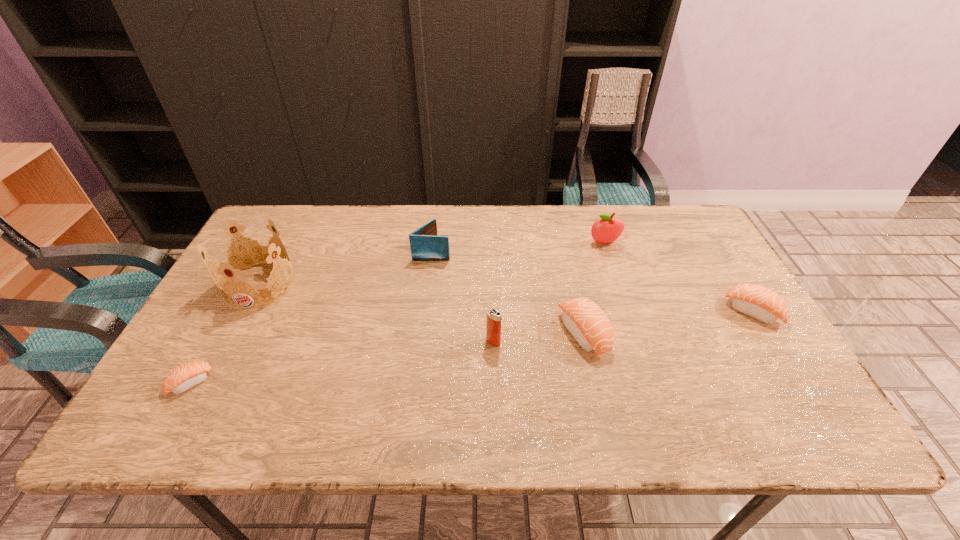
You are a GUI agent. You are given a task and a screenshot of the screen. Output one action in this format:
    pyautogui.click(x=<x>, y=<y>)
    Task: Click on the sushi situated at the left edge
    
    Given the screenshot: What is the action you would take?
    tap(184, 377)

Where is `crown that is at the left edge`? Image resolution: width=960 pixels, height=540 pixels. crown that is at the left edge is located at coordinates (246, 257).

In order to click on object that is at the right edge in this screenshot , I will do `click(758, 302)`.

Where is `object that is at the near left corner`? object that is at the near left corner is located at coordinates (184, 377).

In the image, there is a desktop. Identify the location of free space at the far edge. The image size is (960, 540). (415, 210).

This screenshot has height=540, width=960. In order to click on vacant area at the near edge of the desktop in this screenshot , I will do `click(375, 399)`.

In the image, there is a desktop. Find the location of `free space at the left edge`. free space at the left edge is located at coordinates (214, 323).

Where is `free spot at the right edge of the desktop`? This screenshot has width=960, height=540. free spot at the right edge of the desktop is located at coordinates (689, 279).

Where is `free location at the near left corner of the desktop`? free location at the near left corner of the desktop is located at coordinates (201, 384).

The height and width of the screenshot is (540, 960). I want to click on free location at the far right corner of the desktop, so click(x=687, y=233).